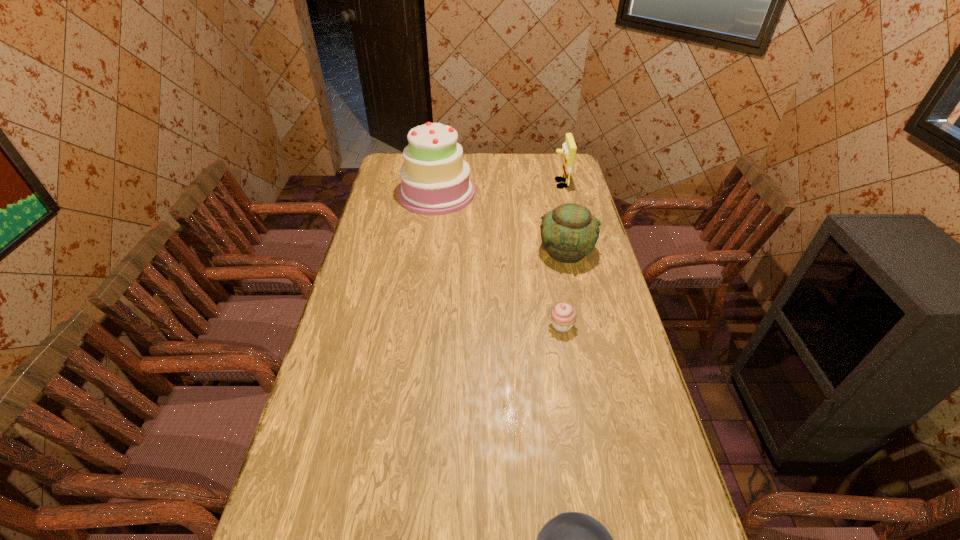
This screenshot has height=540, width=960. Identify the location of the tallest object. (435, 179).

Image resolution: width=960 pixels, height=540 pixels. I want to click on cake, so click(435, 179).

The height and width of the screenshot is (540, 960). Identify the location of sponge. (569, 148).

This screenshot has width=960, height=540. I want to click on pottery, so (x=569, y=232).

The height and width of the screenshot is (540, 960). In order to click on the third shortest object in this screenshot , I will do `click(569, 232)`.

The height and width of the screenshot is (540, 960). Identify the location of cupcake. (563, 316).

Locate an element on the screen. the second shortest object is located at coordinates (x=563, y=316).

Find the location of `vacant space located 0.350m on the front of the cake`. vacant space located 0.350m on the front of the cake is located at coordinates (426, 271).

You are a GUI agent. You are given a task and a screenshot of the screen. Output one action in this format:
    pyautogui.click(x=<x>, y=<y>)
    Task: Click on the free space located on the face of the sponge
    
    Given the screenshot: What is the action you would take?
    pyautogui.click(x=478, y=184)

Find the location of a particular element. The height and width of the screenshot is (540, 960). free region located 0.200m on the face of the sponge is located at coordinates (509, 184).